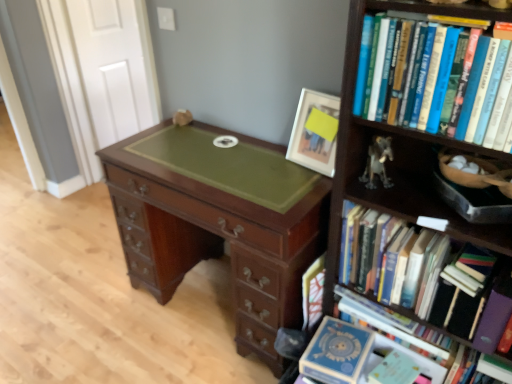
Question: Is hardcover books at right, which appears as the second book when viewed from the top, thinner than mahogany wood desk at center?

Choices:
 (A) no
 (B) yes

Answer: (B)

Question: Is hardcover books at right, which appears as the second book when viewed from the top, surrounding mahogany wood desk at center?

Choices:
 (A) yes
 (B) no

Answer: (B)

Question: Are hardcover books at right, which appears as the second book when viewed from the top, and mahogany wood desk at center located far from each other?

Choices:
 (A) no
 (B) yes

Answer: (A)

Question: From the image's perspective, would you say hardcover books at right, which appears as the second book when viewed from the top, is positioned over mahogany wood desk at center?

Choices:
 (A) no
 (B) yes

Answer: (A)

Question: Does hardcover books at right, the third book positioned from the bottom, appear on the right side of mahogany wood desk at center?

Choices:
 (A) yes
 (B) no

Answer: (A)

Question: Is the depth of hardcover books at right, which appears as the second book when viewed from the top, greater than that of mahogany wood desk at center?

Choices:
 (A) no
 (B) yes

Answer: (A)

Question: Is metallic silver figurine at upper right taller than hardcover books at right, the third book positioned from the bottom?

Choices:
 (A) no
 (B) yes

Answer: (A)

Question: Is metallic silver figurine at upper right positioned behind hardcover books at right, the third book positioned from the bottom?

Choices:
 (A) yes
 (B) no

Answer: (A)

Question: From a real-world perspective, is metallic silver figurine at upper right positioned over hardcover books at right, which appears as the second book when viewed from the top, based on gravity?

Choices:
 (A) no
 (B) yes

Answer: (B)

Question: Is metallic silver figurine at upper right to the right of hardcover books at right, which appears as the second book when viewed from the top, from the viewer's perspective?

Choices:
 (A) yes
 (B) no

Answer: (B)

Question: Can you confirm if metallic silver figurine at upper right is thinner than hardcover books at right, which appears as the second book when viewed from the top?

Choices:
 (A) yes
 (B) no

Answer: (A)

Question: Does metallic silver figurine at upper right have a larger size compared to hardcover books at right, which appears as the second book when viewed from the top?

Choices:
 (A) yes
 (B) no

Answer: (B)

Question: Considering the relative positions of hardcover books at upper right, the fourth book from the bottom, and hardcover books at right, which is the fourth book in top-to-bottom order, in the image provided, is hardcover books at upper right, the fourth book from the bottom, behind hardcover books at right, which is the fourth book in top-to-bottom order,?

Choices:
 (A) yes
 (B) no

Answer: (B)